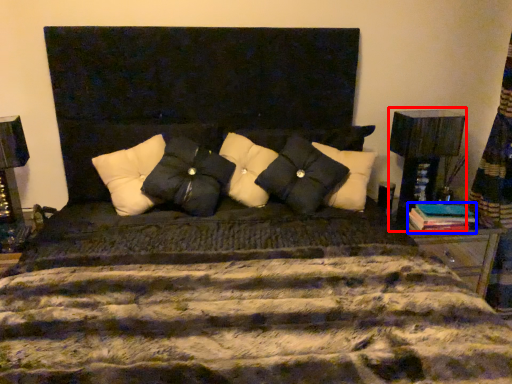
Question: Among these objects, which one is farthest to the camera, table lamp (highlighted by a red box) or book (highlighted by a blue box)?

Choices:
 (A) table lamp
 (B) book

Answer: (A)